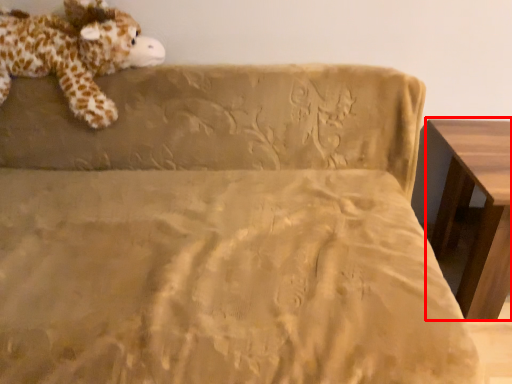
Question: From the image, what is the correct spatial relationship of table (annotated by the red box) in relation to animal?

Choices:
 (A) left
 (B) right

Answer: (B)